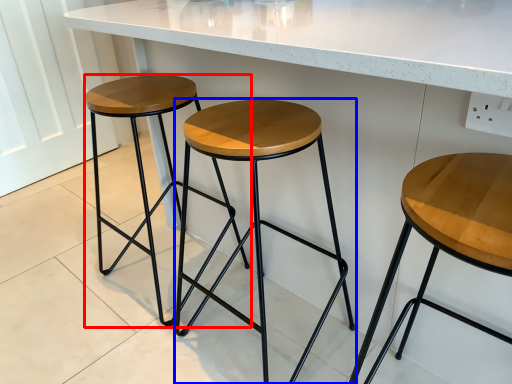
Question: Which object is closer to the camera taking this photo, stool (highlighted by a red box) or stool (highlighted by a blue box)?

Choices:
 (A) stool
 (B) stool

Answer: (B)